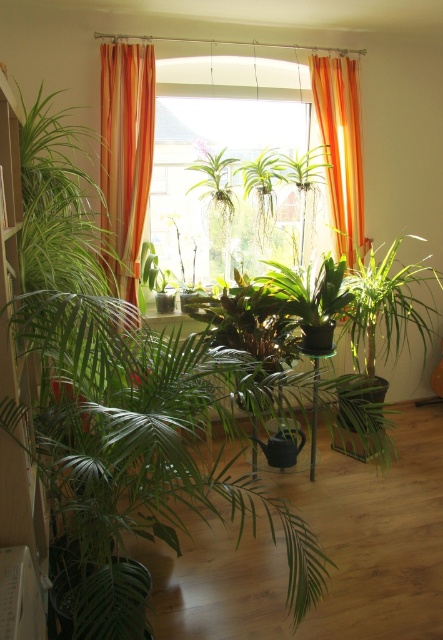
Can you confirm if transparent glass window at center is taller than orange fabric curtain at center?

No.

Is point (276, 150) positioned before point (353, 65)?

No, it is behind (353, 65).

Image resolution: width=443 pixels, height=640 pixels. What are the coordinates of `transparent glass window at center` in the screenshot? It's located at (221, 184).

Does orange striped curtain at left have a lesser height compared to orange fabric curtain at center?

Incorrect, orange striped curtain at left's height does not fall short of orange fabric curtain at center's.

Describe the element at coordinates (125, 157) in the screenshot. I see `orange striped curtain at left` at that location.

Which is behind, point (152, 115) or point (357, 128)?

The point (357, 128) is behind.

Find the location of a particular element. orange striped curtain at left is located at coordinates (125, 157).

Between green leafy plant at center and transparent glass table at center, which one is positioned higher?

Positioned higher is green leafy plant at center.

Can you confirm if green leafy plant at center is positioned below transparent glass table at center?

No.

Does point (228, 195) lie behind point (311, 355)?

Yes.

Locate an element on the screen. The width and height of the screenshot is (443, 640). green leafy plant at center is located at coordinates (214, 180).